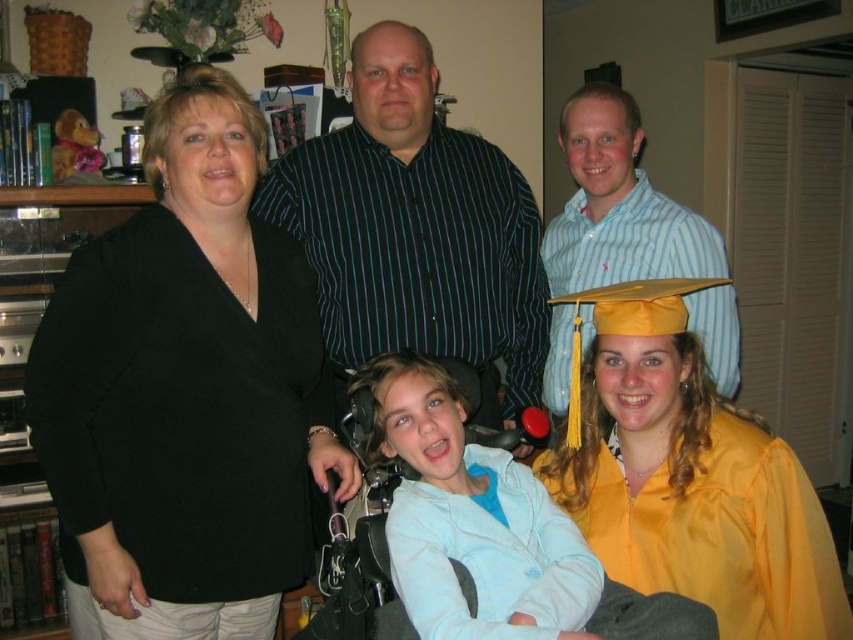
Question: Estimate the real-world distances between objects in this image. Which object is closer to the yellow satin graduation gown at center?

Choices:
 (A) light blue fleece at center
 (B) light blue striped shirt at upper right

Answer: (B)

Question: Is black matte blazer at center positioned at the back of light blue fleece at center?

Choices:
 (A) yes
 (B) no

Answer: (A)

Question: In this image, where is black matte blazer at center located relative to yellow satin graduation gown at center?

Choices:
 (A) left
 (B) right

Answer: (A)

Question: Which object appears farthest from the camera in this image?

Choices:
 (A) light blue striped shirt at upper right
 (B) yellow satin graduation gown at lower right
 (C) light blue fleece at center

Answer: (A)

Question: Considering the relative positions of black matte blazer at center and light blue striped shirt at upper right in the image provided, where is black matte blazer at center located with respect to light blue striped shirt at upper right?

Choices:
 (A) below
 (B) above

Answer: (A)

Question: Based on their relative distances, which object is farther from the yellow satin graduation gown at center?

Choices:
 (A) light blue fleece at center
 (B) black matte blazer at center
 (C) yellow satin graduation gown at lower right
 (D) light blue striped shirt at upper right

Answer: (A)